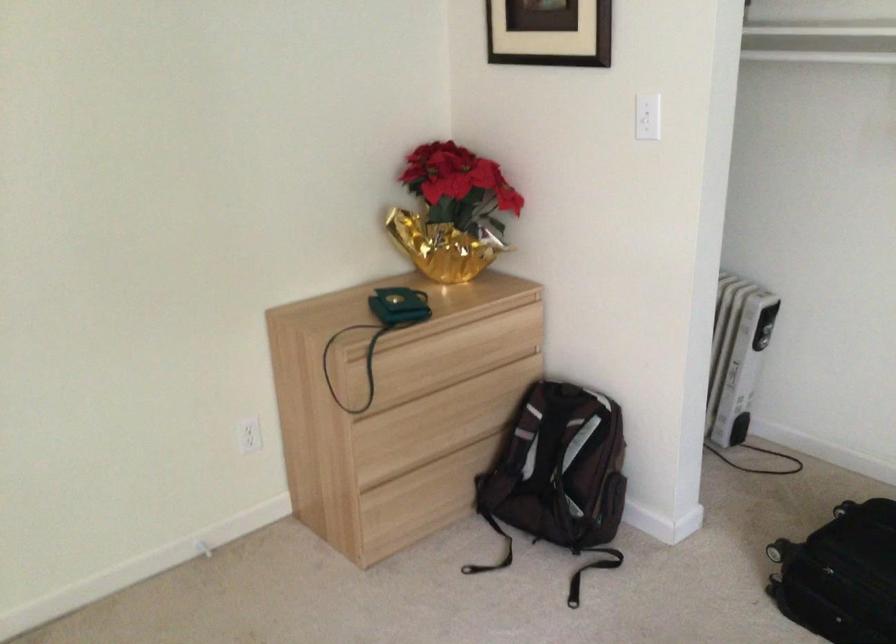
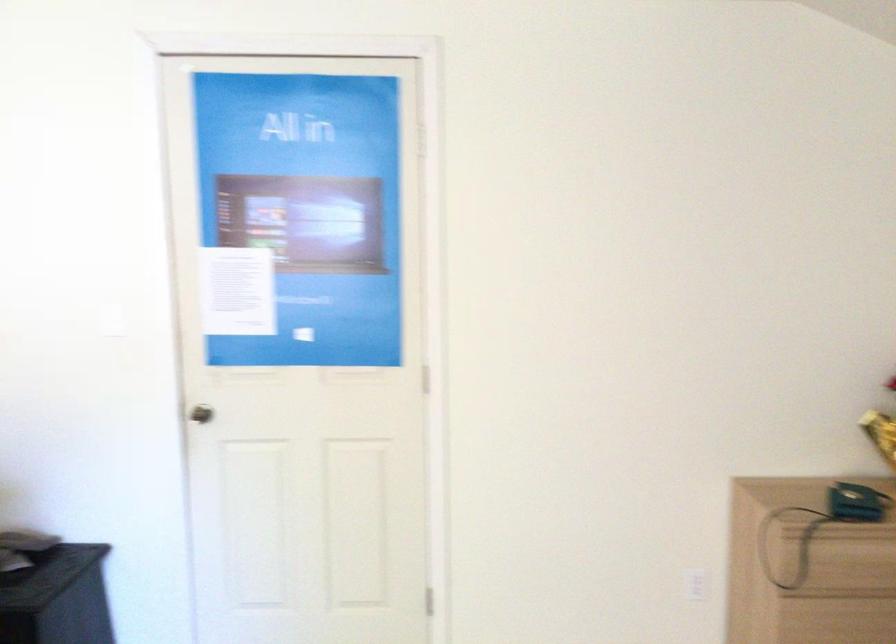
Question: How did the camera likely rotate?

Choices:
 (A) Left
 (B) Right
 (C) Up
 (D) Down

Answer: (A)